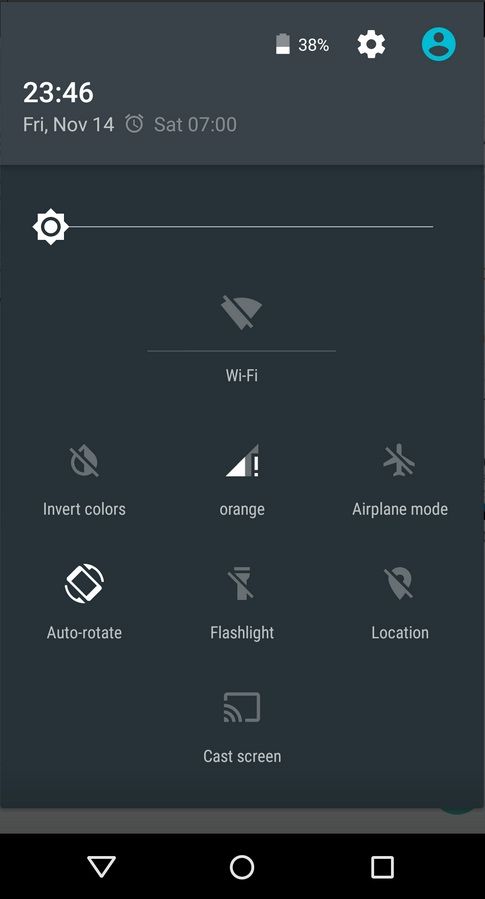
This screenshot has width=485, height=899. Find the location of `brightness slider`. brightness slider is located at coordinates (51, 218).